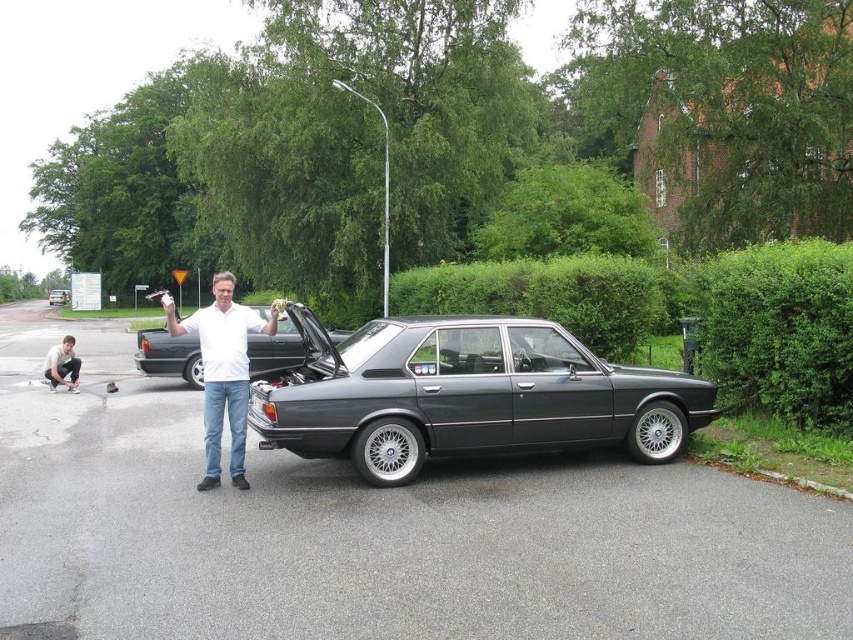
Is white matte shirt at center shorter than satin black sedan at center?

No, white matte shirt at center is not shorter than satin black sedan at center.

Consider the image. Who is shorter, white matte shirt at center or satin black sedan at center?

Standing shorter between the two is satin black sedan at center.

The width and height of the screenshot is (853, 640). Find the location of `white matte shirt at center`. white matte shirt at center is located at coordinates (223, 371).

Can you confirm if satin black sedan at center is shorter than metallic silver sedan at center?

Yes.

Measure the distance between point (178,349) and camera.

The distance of point (178,349) from camera is 46.23 feet.

Measure the distance between satin black sedan at center and camera.

6.56 meters

What are the coordinates of `satin black sedan at center` in the screenshot? It's located at (169, 355).

Can you confirm if metallic gray sedan at center is positioned to the right of metallic silver sedan at center?

Yes, metallic gray sedan at center is to the right of metallic silver sedan at center.

Is point (328, 397) less distant than point (59, 296)?

Yes, it is in front of point (59, 296).

The image size is (853, 640). In order to click on metallic gray sedan at center in this screenshot , I will do `click(467, 396)`.